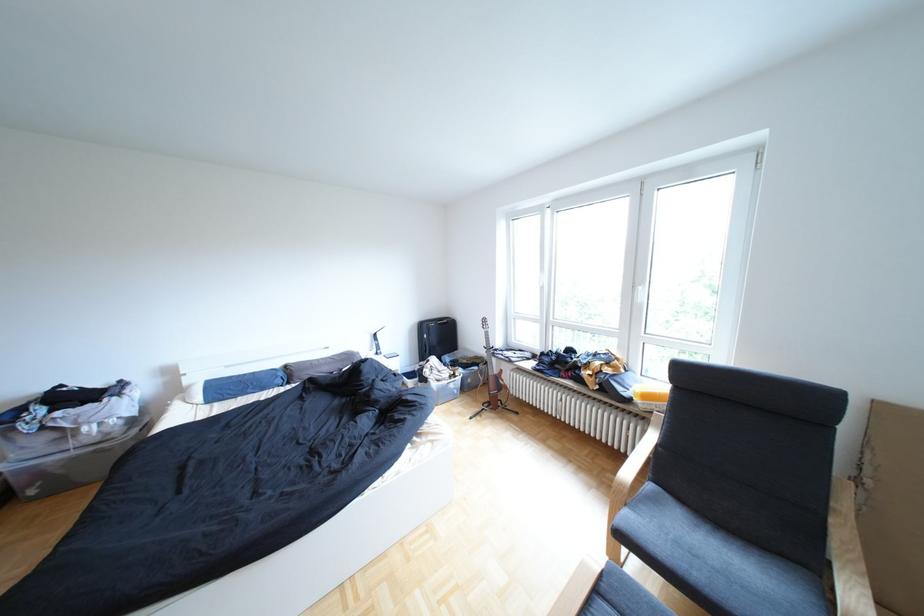
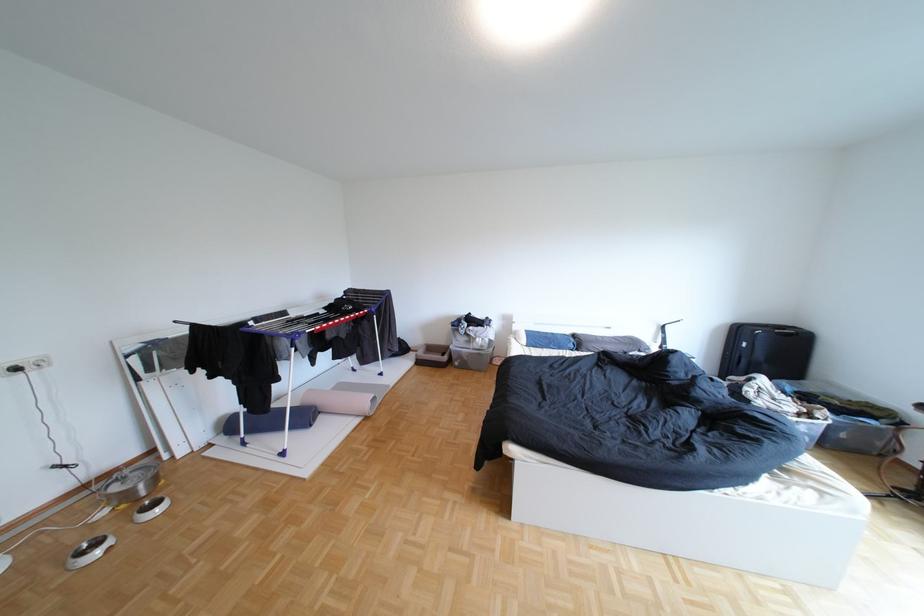
Find the pixel in the second image that matches the point at 47,493 in the first image.

(472, 363)